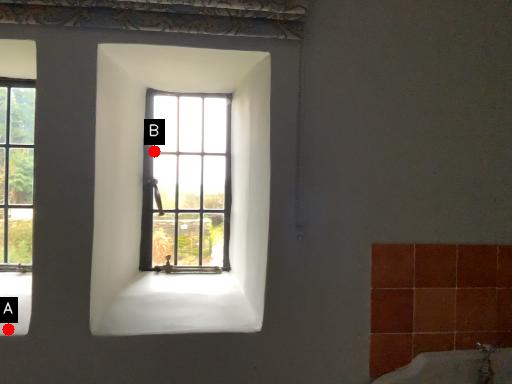
Question: Two points are circled on the image, labeled by A and B beside each circle. Which point is closer to the camera?

Choices:
 (A) A is closer
 (B) B is closer

Answer: (A)